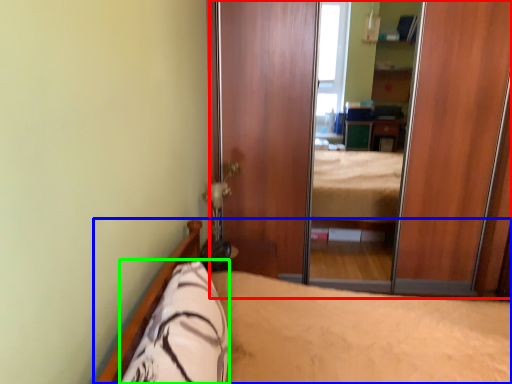
Question: Based on their relative distances, which object is nearer to screen door (highlighted by a red box)? Choose from bed (highlighted by a blue box) and pillow (highlighted by a green box).

Choices:
 (A) bed
 (B) pillow

Answer: (A)